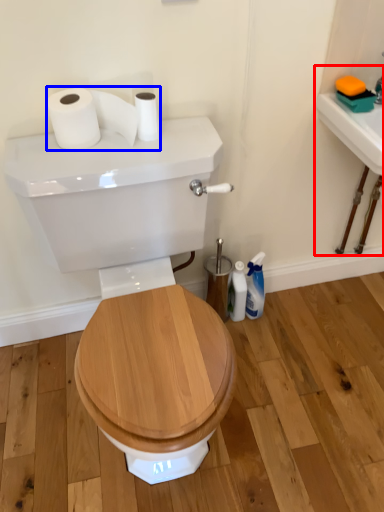
Question: Which point is further to the camera, sink (highlighted by a red box) or toilet paper (highlighted by a blue box)?

Choices:
 (A) sink
 (B) toilet paper

Answer: (A)